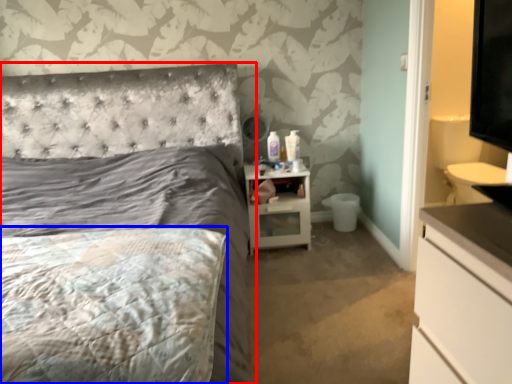
Question: Which point is further to the camera, bed (highlighted by a red box) or mattress (highlighted by a blue box)?

Choices:
 (A) bed
 (B) mattress

Answer: (B)